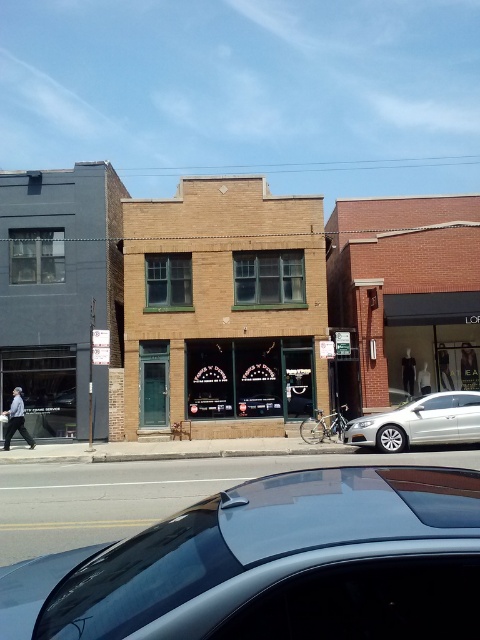
Question: Can you confirm if metallic blue car at center is wider than silver metallic sedan at lower right?

Choices:
 (A) no
 (B) yes

Answer: (A)

Question: Considering the relative positions of brown brick building at center and dark gray concrete building at left in the image provided, where is brown brick building at center located with respect to dark gray concrete building at left?

Choices:
 (A) below
 (B) above

Answer: (A)

Question: Which of these objects is positioned farthest from the brown brick building at center?

Choices:
 (A) metallic blue car at center
 (B) dark gray concrete building at left
 (C) silver metallic sedan at lower right

Answer: (A)

Question: Does metallic blue car at center appear over silver metallic sedan at lower right?

Choices:
 (A) yes
 (B) no

Answer: (A)

Question: Which point is farther to the camera?

Choices:
 (A) (424, 413)
 (B) (97, 316)

Answer: (B)

Question: Based on their relative distances, which object is farther from the silver metallic sedan at lower right?

Choices:
 (A) dark gray concrete building at left
 (B) brown brick building at center
 (C) metallic blue car at center

Answer: (C)